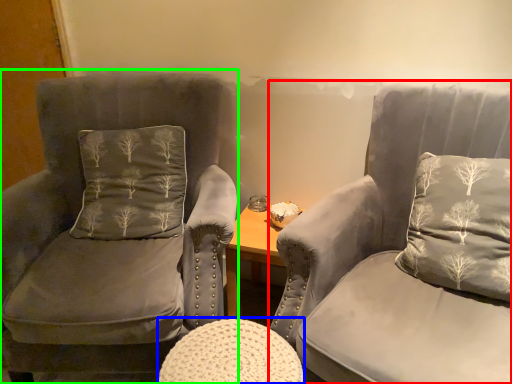
Question: Which is farther away from chair (highlighted by a red box)? stool (highlighted by a blue box) or chair (highlighted by a green box)?

Choices:
 (A) stool
 (B) chair

Answer: (B)